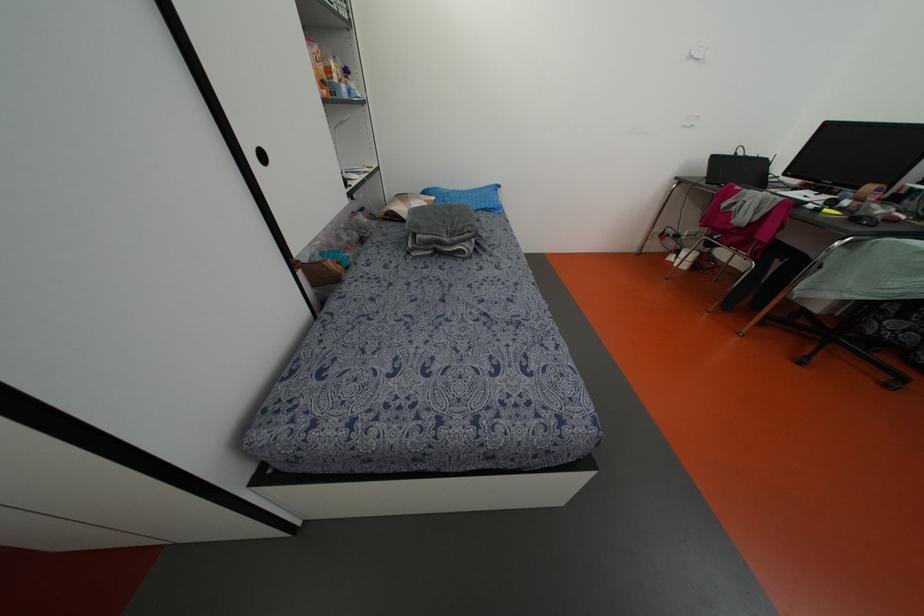
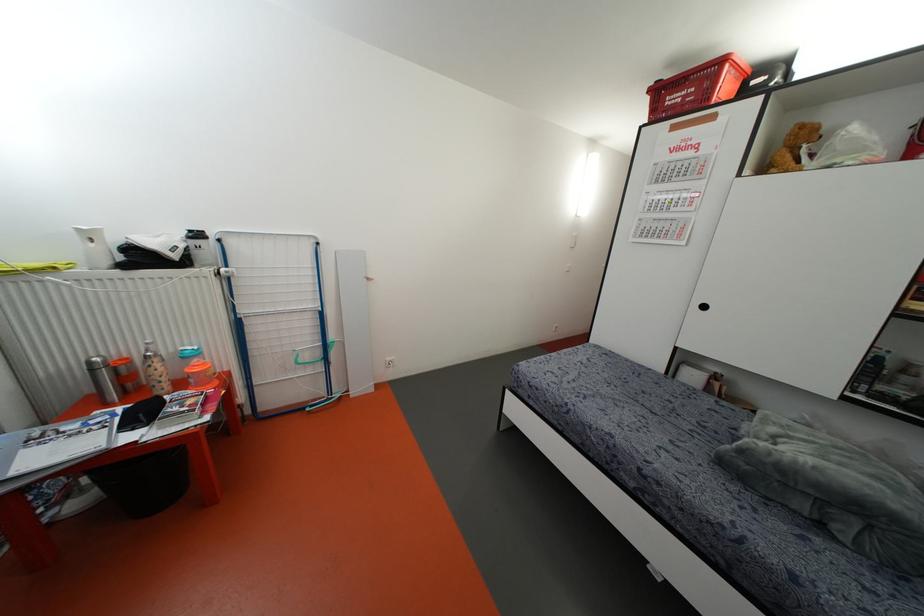
In the second image, find the point that corresponds to point (262, 156) in the first image.

(703, 307)